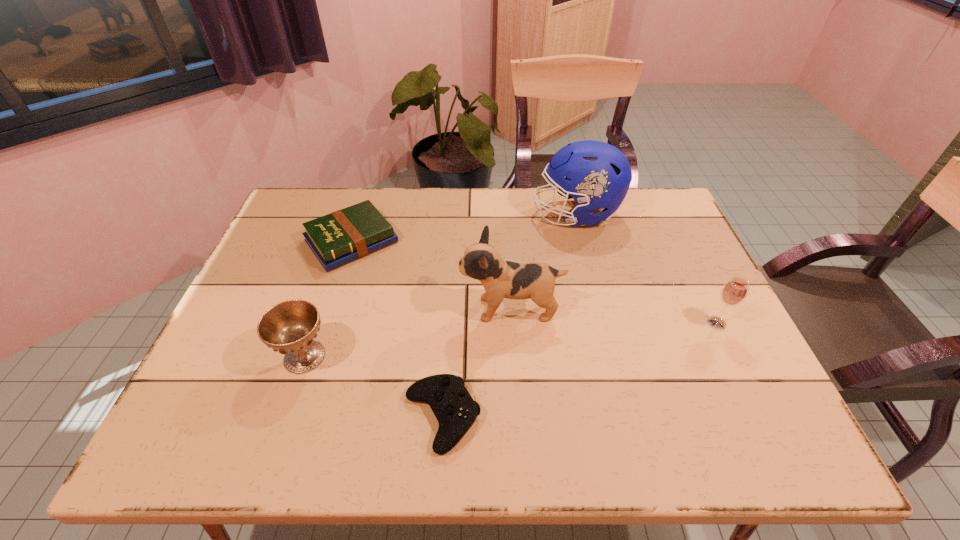
The width and height of the screenshot is (960, 540). Identify the location of free region at the far right corner of the desktop. (641, 210).

Find the location of a particular element. This screenshot has width=960, height=540. vacant space at the near right corner of the desktop is located at coordinates (758, 415).

I want to click on free space that is in between the puppy and the football helmet, so click(x=543, y=261).

This screenshot has height=540, width=960. I want to click on vacant area that lies between the shortest object and the wineglass, so pos(580,370).

The width and height of the screenshot is (960, 540). Identify the location of empty space between the puppy and the nearest object. (476, 363).

Find the location of a particular element. The height and width of the screenshot is (540, 960). vacant space that's between the football helmet and the chalice is located at coordinates (441, 285).

I want to click on free spot between the puppy and the football helmet, so click(543, 261).

Image resolution: width=960 pixels, height=540 pixels. In order to click on unoccupied position between the book and the puppy in this screenshot , I will do `click(431, 275)`.

Find the location of a particular element. The image size is (960, 540). unoccupied position between the puppy and the rightmost object is located at coordinates (613, 316).

Where is `empty space that is in between the book and the football helmet`? This screenshot has height=540, width=960. empty space that is in between the book and the football helmet is located at coordinates (464, 227).